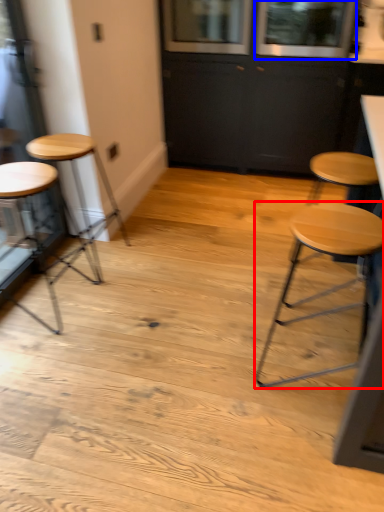
Question: Which point is closer to the camera, stool (highlighted by a red box) or window (highlighted by a blue box)?

Choices:
 (A) stool
 (B) window

Answer: (A)